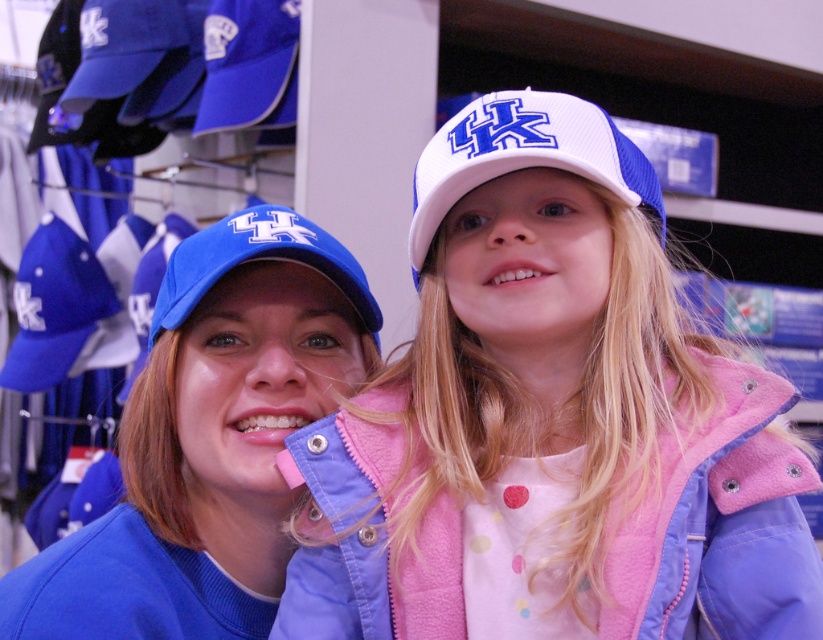
Looking at this image, you are standing in a sports store and see a point marked at coordinates (607, 129). If you want to place a 12 inch wide box on the floor, will it fit in the space between you and that point?

The distance between you and the point is 34.02 inches. Since the box is 12 inches wide, there is enough space to place it as the distance is greater than the box width.